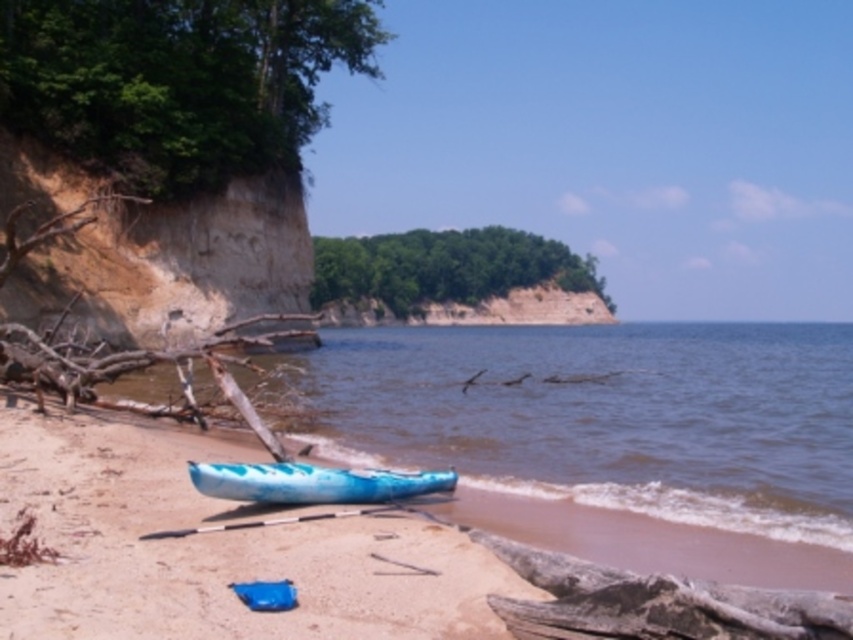
Question: Which of the following is the closest to the observer?

Choices:
 (A) blue glossy canoe at lower center
 (B) blue plastic kayak at center

Answer: (B)

Question: Is blue plastic kayak at center bigger than blue glossy canoe at lower center?

Choices:
 (A) yes
 (B) no

Answer: (A)

Question: Does blue plastic kayak at center appear under blue glossy canoe at lower center?

Choices:
 (A) yes
 (B) no

Answer: (B)

Question: Can you confirm if blue plastic kayak at center is smaller than blue glossy canoe at lower center?

Choices:
 (A) yes
 (B) no

Answer: (B)

Question: Which of the following is the closest to the observer?

Choices:
 (A) (90, 554)
 (B) (337, 468)

Answer: (A)